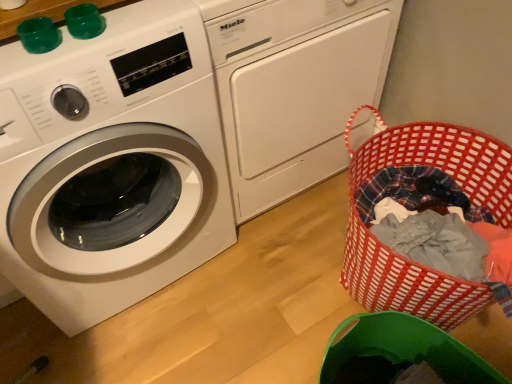
Question: Does white glossy washing machine at left, the first washing machine when ordered from right to left, turn towards red woven laundry basket at lower right?

Choices:
 (A) no
 (B) yes

Answer: (B)

Question: Is white glossy washing machine at left, which is the second washing machine from left to right, smaller than red woven laundry basket at lower right?

Choices:
 (A) no
 (B) yes

Answer: (A)

Question: Is white glossy washing machine at left, which is the second washing machine from left to right, far from red woven laundry basket at lower right?

Choices:
 (A) yes
 (B) no

Answer: (B)

Question: Is white glossy washing machine at left, the first washing machine when ordered from right to left, to the left of red woven laundry basket at lower right from the viewer's perspective?

Choices:
 (A) yes
 (B) no

Answer: (A)

Question: Would you say white glossy washing machine at left, the first washing machine when ordered from right to left, is outside red woven laundry basket at lower right?

Choices:
 (A) no
 (B) yes

Answer: (B)

Question: From the image's perspective, is white glossy washing machine at left, which is the second washing machine from left to right, positioned above or below red woven laundry basket at lower right?

Choices:
 (A) above
 (B) below

Answer: (A)

Question: Relative to red woven laundry basket at lower right, is white glossy washing machine at left, which is the second washing machine from left to right, in front or behind?

Choices:
 (A) behind
 (B) front

Answer: (B)

Question: Is point (312, 77) closer or farther from the camera than point (505, 150)?

Choices:
 (A) farther
 (B) closer

Answer: (A)

Question: Considering the positions of white glossy washing machine at left, which is the second washing machine from left to right, and red woven laundry basket at lower right in the image, is white glossy washing machine at left, which is the second washing machine from left to right, taller or shorter than red woven laundry basket at lower right?

Choices:
 (A) short
 (B) tall

Answer: (B)

Question: Is point (474, 130) closer or farther from the camera than point (151, 29)?

Choices:
 (A) closer
 (B) farther

Answer: (B)

Question: Is red woven laundry basket at lower right bigger or smaller than white glossy washing machine at left, which ranks as the first washing machine in left-to-right order?

Choices:
 (A) big
 (B) small

Answer: (B)

Question: Is red woven laundry basket at lower right inside or outside of white glossy washing machine at left, the second washing machine from the right?

Choices:
 (A) inside
 (B) outside

Answer: (B)

Question: Is red woven laundry basket at lower right to the left or to the right of white glossy washing machine at left, the second washing machine from the right, in the image?

Choices:
 (A) left
 (B) right

Answer: (B)

Question: In terms of height, does white glossy washing machine at left, which is the second washing machine from left to right, look taller or shorter compared to white glossy washing machine at left, the second washing machine from the right?

Choices:
 (A) short
 (B) tall

Answer: (A)

Question: Is white glossy washing machine at left, which is the second washing machine from left to right, to the left or to the right of white glossy washing machine at left, the second washing machine from the right, in the image?

Choices:
 (A) left
 (B) right

Answer: (B)